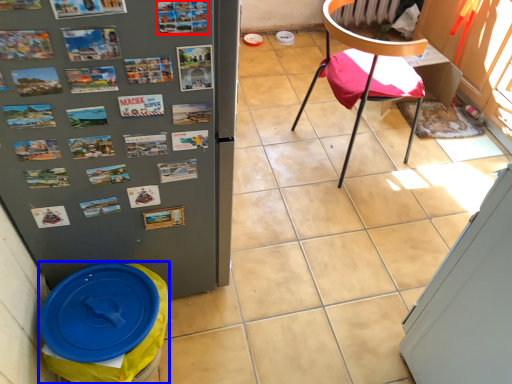
Question: Which of the following is the farthest to the observer, poster (highlighted by a red box) or garbage (highlighted by a blue box)?

Choices:
 (A) poster
 (B) garbage

Answer: (B)